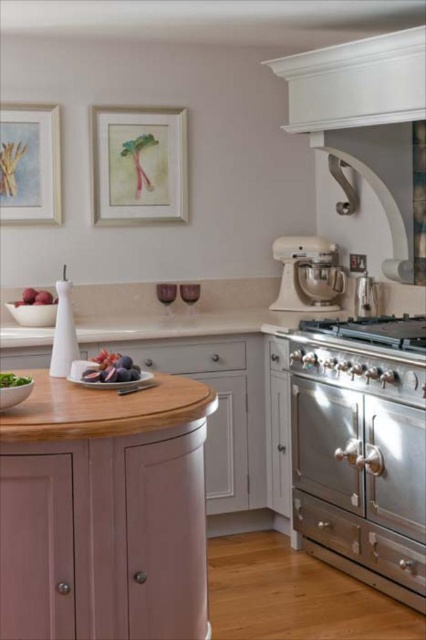
Question: Which point appears closest to the camera in this image?

Choices:
 (A) (331, 272)
 (B) (11, 378)
 (C) (54, 304)

Answer: (B)

Question: Can you confirm if beige matte stand mixer at right is smaller than purple matte grapes at center?

Choices:
 (A) yes
 (B) no

Answer: (B)

Question: Which of the following is the closest to the observer?

Choices:
 (A) stainless steel drawer at lower right
 (B) green leafy salad at left

Answer: (B)

Question: In this image, where is stainless steel oven at right located relative to green leafy salad at left?

Choices:
 (A) below
 (B) above

Answer: (A)

Question: Which object is closer to the camera taking this photo?

Choices:
 (A) matte white drawer at center
 (B) stainless steel drawer at lower right

Answer: (B)

Question: Observing the image, what is the correct spatial positioning of stainless steel stove at right in reference to green leafy salad at left?

Choices:
 (A) below
 (B) above

Answer: (B)